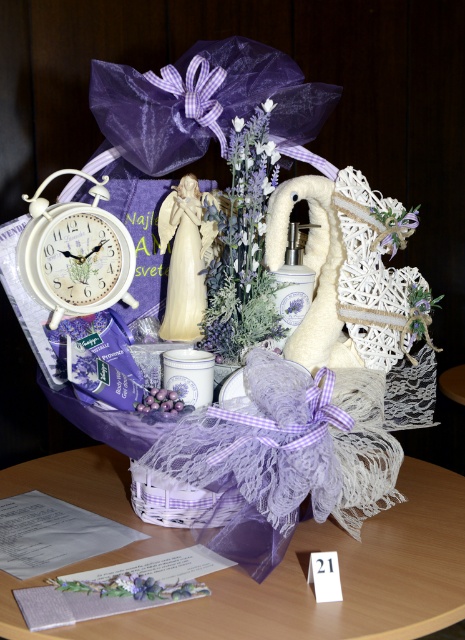
Can you confirm if lavender lace basket at center is shorter than white porcelain figurine at center?

Correct, lavender lace basket at center is not as tall as white porcelain figurine at center.

Does lavender lace basket at center appear over white porcelain figurine at center?

Actually, lavender lace basket at center is below white porcelain figurine at center.

Between point (99, 561) and point (185, 225), which one is positioned in front?

Point (99, 561) is in front.

Where is `lavender lace basket at center`? This screenshot has width=465, height=640. lavender lace basket at center is located at coordinates (274, 568).

Is white porcelain figurine at center positioned in front of lavender fabric basket at center?

No.

Can you confirm if white porcelain figurine at center is taller than lavender fabric basket at center?

Yes, white porcelain figurine at center is taller than lavender fabric basket at center.

Which is behind, point (165, 337) or point (196, 525)?

Point (165, 337)

This screenshot has width=465, height=640. What are the coordinates of `white porcelain figurine at center` in the screenshot? It's located at (185, 259).

In the scene shown: Can you confirm if lavender lace basket at center is bigger than lavender fabric flower at center?

Yes.

Does point (451, 579) come in front of point (260, 266)?

Yes, it is in front of point (260, 266).

Where is `lavender lace basket at center`? This screenshot has width=465, height=640. lavender lace basket at center is located at coordinates (274, 568).